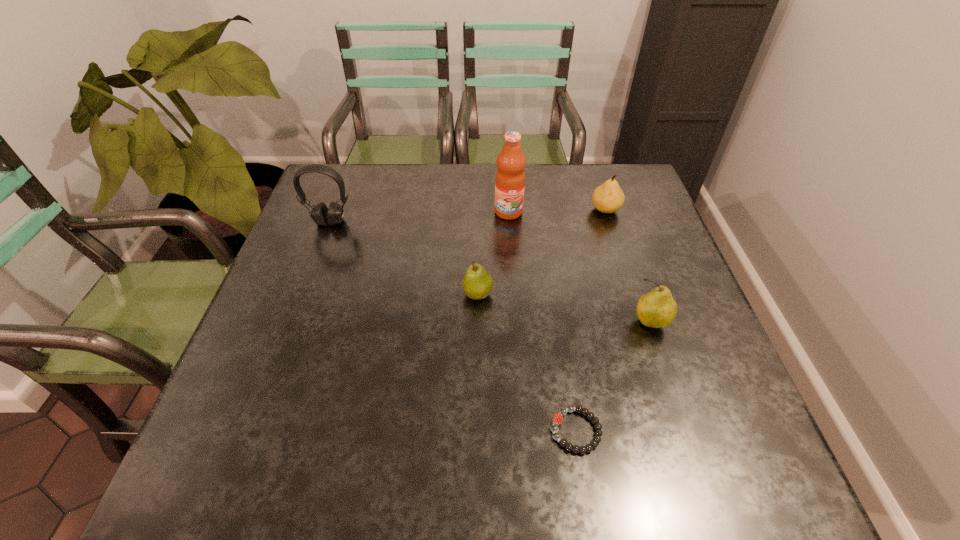
Where is `vacant area that lies between the fourth object from left to right and the headset`? The image size is (960, 540). vacant area that lies between the fourth object from left to right and the headset is located at coordinates (453, 326).

The height and width of the screenshot is (540, 960). In order to click on free spot between the farthest pear and the nearest object in this screenshot , I will do `click(590, 320)`.

At what (x,y) coordinates should I click in order to perform the action: click on blank region between the nearest pear and the tallest object. Please return your answer as a coordinate pair (x, y). This screenshot has width=960, height=540. Looking at the image, I should click on (580, 267).

Locate an element on the screen. free space between the third nearest object and the headset is located at coordinates (404, 258).

The image size is (960, 540). Identify the location of vacant area that lies between the nearest pear and the headset. (491, 272).

What are the coordinates of `empty location between the second nearest object and the fourth farthest object` in the screenshot? It's located at (564, 308).

Where is `object that ranks as the closest to the nearest pear`? The image size is (960, 540). object that ranks as the closest to the nearest pear is located at coordinates (558, 418).

Identify the location of the fourth closest object relative to the second object from left to right. The image size is (960, 540). (321, 215).

Locate an element on the screen. pear that is the closest one to the shortest object is located at coordinates (657, 309).

Point out which pear is positioned as the nearest to the leftmost pear. Please provide its 2D coordinates. Your answer should be formatted as a tuple, i.e. [(x, y)], where the tuple contains the x and y coordinates of a point satisfying the conditions above.

[(657, 309)]